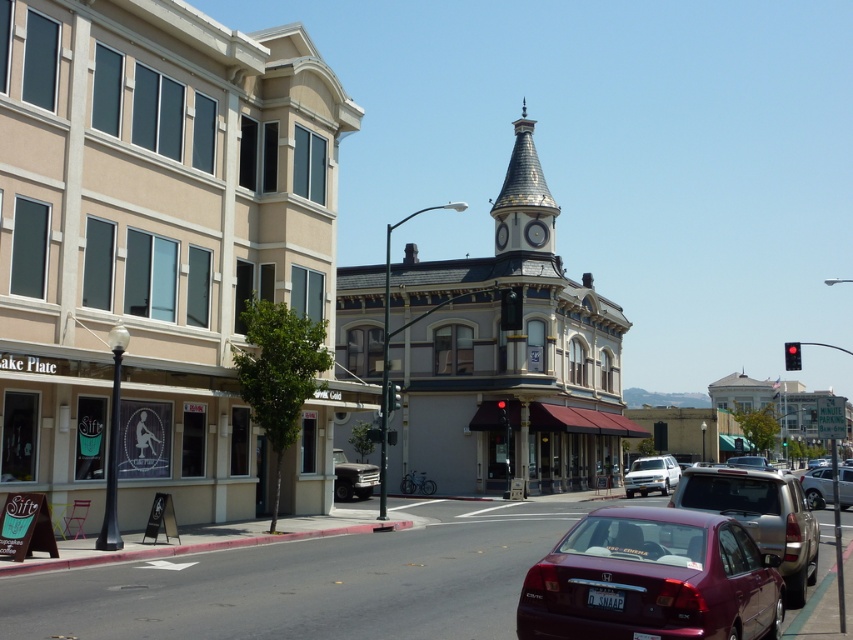
You are standing at the center of the street in the image. There is a point marked at coordinates (653, 580). What object is located at this point?

The point at coordinates (653, 580) marks the location of the maroon metallic sedan at lower right.

You are standing on the street and want to take a photo of both the red Honda Civic parked on the right and the beige building with the Sift sign. Which point, point (663, 586) or point (662, 472), is closer to you when you aim your camera?

Point (663, 586) is closer to the viewer than point (662, 472), so it will appear nearer in your photo.

You are a delivery driver trying to park your 1.8 meter wide truck between the satin silver sedan at center and the green glass traffic light at center. Can your truck fit in the space between them?

The satin silver sedan at center is wider than the green glass traffic light at center. Since the sedan is wider, the space between them might not be sufficient for a 1.8 meter wide truck. However, without knowing the exact distance between the two objects, it is impossible to determine if the truck can fit.